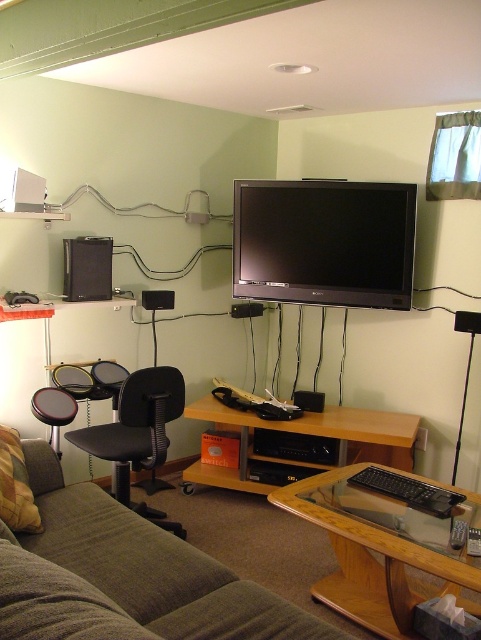
You are a delivery person who needs to place a package that is 1.2 meters long between the flat screen tv at upper center and the woodendesk at lower center. Can the package fit in the space between them?

The distance between the flat screen tv at upper center and the woodendesk at lower center is 1.02 meters, which is shorter than the package length of 1.2 meters. Therefore, the package cannot fit between them.